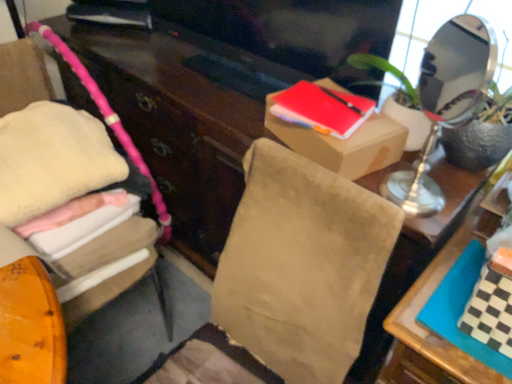
Question: In the image, is matte red notebook at upper center, which is counted as the 1th book, starting from the left, on the left side or the right side of matte cardboard box at upper right?

Choices:
 (A) right
 (B) left

Answer: (B)

Question: Is matte red notebook at upper center, which is counted as the 1th book, starting from the left, inside the boundaries of matte cardboard box at upper right, or outside?

Choices:
 (A) outside
 (B) inside

Answer: (A)

Question: Estimate the real-world distances between objects in this image. Which object is farther from the matte cardboard box at upper right?

Choices:
 (A) matte red notebook at upper center, acting as the first book starting from the back
 (B) soft pink fabric at left
 (C) green textured plant at upper right
 (D) checkerboard-patterned book at right, arranged as the 1th book when ordered from the bottom

Answer: (B)

Question: Considering the real-world distances, which object is closest to the checkerboard-patterned book at right, which is the first book from front to back?

Choices:
 (A) matte red notebook at upper center, which is counted as the 1th book, starting from the left
 (B) soft pink fabric at left
 (C) green textured plant at upper right
 (D) matte cardboard box at upper right

Answer: (C)